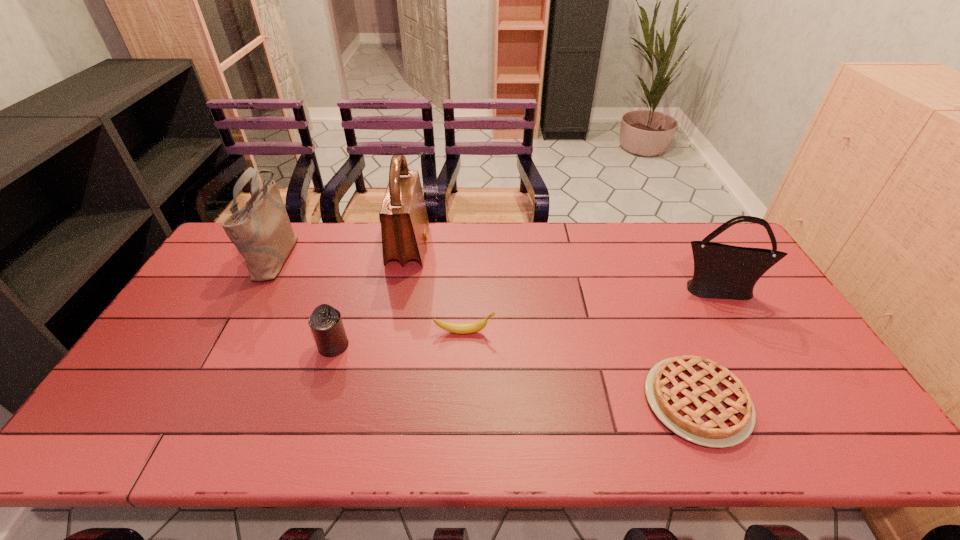
At what (x,y) coordinates should I click in order to perform the action: click on free space in the image that satisfies the following two spatial constraints: 1. on the front-facing side of the leftmost shoulder bag; 2. on the back side of the third tallest object. Please return your answer as a coordinate pair (x, y). The image size is (960, 540). Looking at the image, I should click on (258, 289).

Where is `free spot that satisfies the following two spatial constraints: 1. on the front side of the third shortest object; 2. on the right side of the shortest object`? This screenshot has width=960, height=540. free spot that satisfies the following two spatial constraints: 1. on the front side of the third shortest object; 2. on the right side of the shortest object is located at coordinates (x=316, y=401).

Where is `vacant area in the image that satisfies the following two spatial constraints: 1. at the stem of the second shortest object; 2. on the front side of the fourth tallest object`? The width and height of the screenshot is (960, 540). vacant area in the image that satisfies the following two spatial constraints: 1. at the stem of the second shortest object; 2. on the front side of the fourth tallest object is located at coordinates (464, 346).

Find the location of `vacant space that satisfies the following two spatial constraints: 1. on the back side of the shortest shoulder bag; 2. on the right side of the can`. vacant space that satisfies the following two spatial constraints: 1. on the back side of the shortest shoulder bag; 2. on the right side of the can is located at coordinates (351, 289).

Locate an element on the screen. The image size is (960, 540). vacant space that satisfies the following two spatial constraints: 1. on the front flap of the second shoulder bag from right to left; 2. on the back side of the nearest object is located at coordinates (379, 401).

This screenshot has width=960, height=540. What are the coordinates of `vacant space that satisfies the following two spatial constraints: 1. on the front-facing side of the fourth tallest object; 2. on the right side of the leftmost object` in the screenshot? It's located at (228, 346).